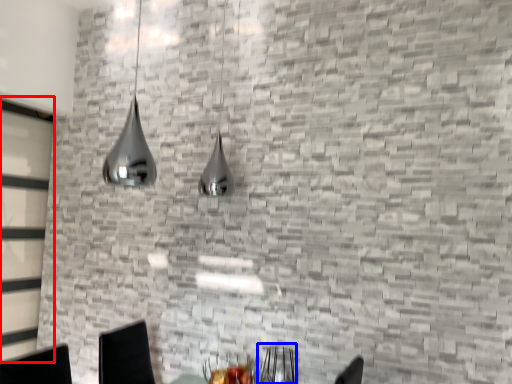
Question: Which object appears farthest to the camera in this image, glass door (highlighted by a red box) or armchair (highlighted by a blue box)?

Choices:
 (A) glass door
 (B) armchair

Answer: (A)